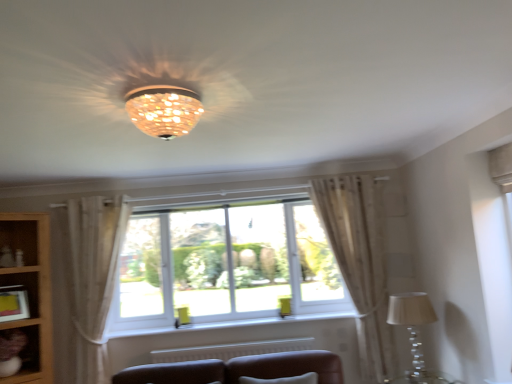
Find the location of a particular element. free location above white textured radiator at lower center (from a real-world perspective) is located at coordinates (228, 342).